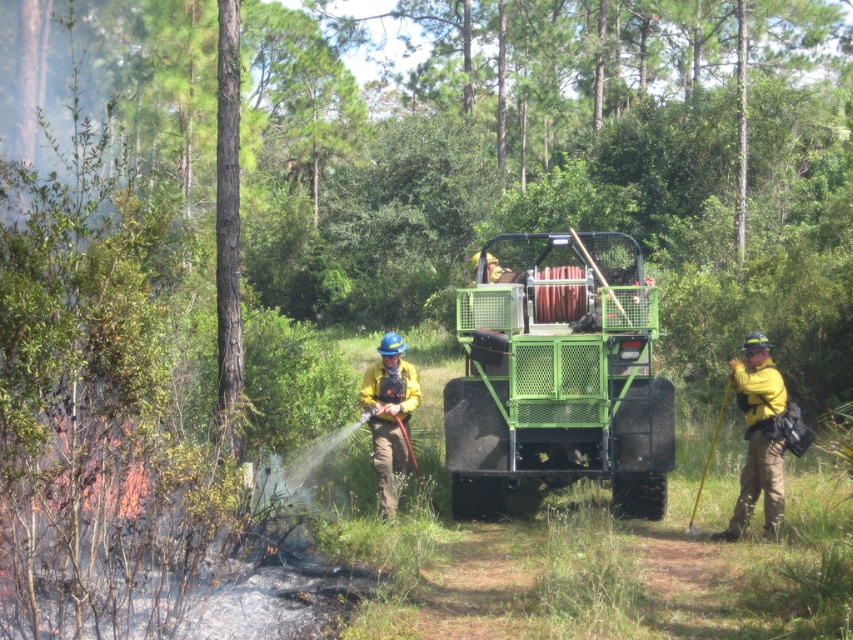
You are a firefighter in the woods and need to retrieve your hard hat before moving to a safer area. You see a yellow fabric fireman at center and a yellow hard hat at right. Which direction should you move to reach your hard hat first?

The yellow hard hat at right is to the right of the yellow fabric fireman at center, so you should move to the right to reach the yellow hard hat at right first.

From the picture: You are a firefighter in the woods and need to locate your equipment. You see the yellow hard hat at right and the yellow fabric fireman at center. Which object is positioned lower in the image?

The yellow hard hat at right is located below the yellow fabric fireman at center, so it is positioned lower in the image.

You are a safety inspector evaluating the scene. You notice the yellow hard hat at right and the yellow fabric fireman at center. Which object has a greater width?

The yellow hard hat at right has a greater width than the yellow fabric fireman at center.